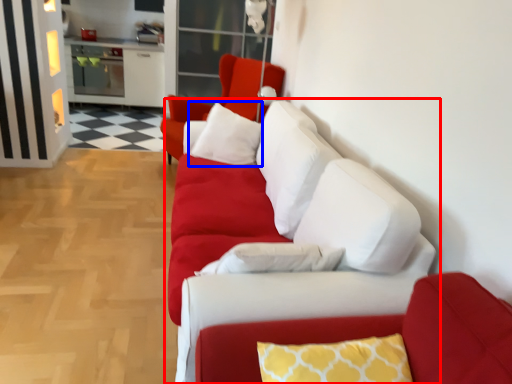
Question: Among these objects, which one is nearest to the camera, studio couch (highlighted by a red box) or pillow (highlighted by a blue box)?

Choices:
 (A) studio couch
 (B) pillow

Answer: (A)